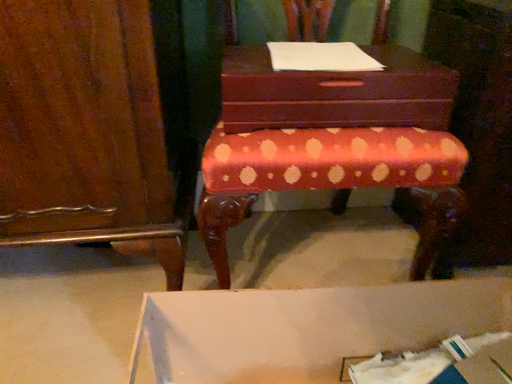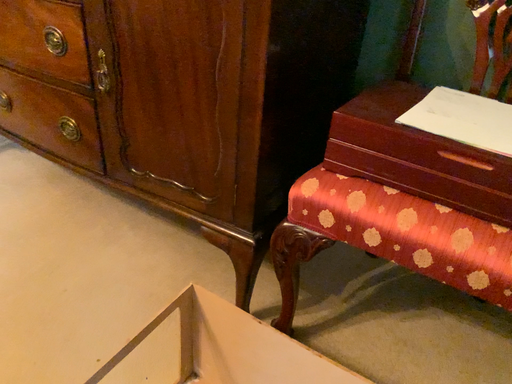
Question: Which way did the camera rotate in the video?

Choices:
 (A) rotated left
 (B) rotated right

Answer: (A)